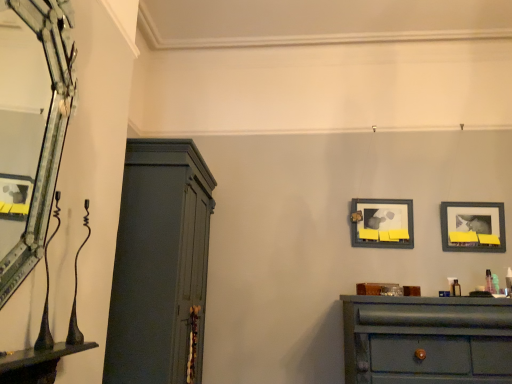
Image resolution: width=512 pixels, height=384 pixels. I want to click on matte green dresser at lower right, so click(x=426, y=340).

Measure the distance between matte green dresser at lower right and camera.

matte green dresser at lower right is 2.17 meters away from camera.

Find the location of a particular element. Image resolution: width=512 pixels, height=384 pixels. wooden framed picture at center, the second picture frame positioned from the right is located at coordinates (382, 223).

The image size is (512, 384). Describe the element at coordinates (160, 265) in the screenshot. I see `matte gray cupboard at left` at that location.

Where is `matte gray cupboard at left`? This screenshot has width=512, height=384. matte gray cupboard at left is located at coordinates (160, 265).

Describe the element at coordinates (472, 226) in the screenshot. I see `matte black picture frame at upper right, which ranks as the first picture frame in right-to-left order` at that location.

In order to click on matte green dresser at lower right in this screenshot , I will do `click(426, 340)`.

Is metallic silver mirror at left facing towards matte gray cupboard at left?

No, metallic silver mirror at left is not oriented towards matte gray cupboard at left.

Considering the sizes of objects metallic silver mirror at left and matte gray cupboard at left in the image provided, who is smaller, metallic silver mirror at left or matte gray cupboard at left?

metallic silver mirror at left is smaller.

How distant is metallic silver mirror at left from matte gray cupboard at left?

A distance of 4.49 feet exists between metallic silver mirror at left and matte gray cupboard at left.

How different are the orientations of metallic silver mirror at left and matte gray cupboard at left in degrees?

The angle between the facing direction of metallic silver mirror at left and the facing direction of matte gray cupboard at left is 0.493 degrees.

Can you confirm if metallic silver mirror at left is taller than matte green dresser at lower right?

Correct, metallic silver mirror at left is much taller as matte green dresser at lower right.

Which object is more forward, metallic silver mirror at left or matte green dresser at lower right?

metallic silver mirror at left is more forward.

Based on the photo, are metallic silver mirror at left and matte green dresser at lower right far apart?

Indeed, metallic silver mirror at left is not near matte green dresser at lower right.

Is point (24, 169) behind point (464, 307)?

Yes, it is behind point (464, 307).

Consider the image. What's the angular difference between matte green dresser at lower right and metallic silver mirror at left's facing directions?

There is a 90.4-degree angle between the facing directions of matte green dresser at lower right and metallic silver mirror at left.

From a real-world perspective, is matte green dresser at lower right located higher than metallic silver mirror at left?

No, from a real-world perspective, matte green dresser at lower right is not over metallic silver mirror at left

From the image's perspective, which is below, matte green dresser at lower right or metallic silver mirror at left?

matte green dresser at lower right.

In terms of height, does matte green dresser at lower right look taller or shorter compared to metallic silver mirror at left?

matte green dresser at lower right is shorter than metallic silver mirror at left.

Is point (415, 307) in front of point (462, 245)?

Yes, it is.

Is matte green dresser at lower right turned away from matte black picture frame at upper right, which ranks as the first picture frame in right-to-left order?

No.

Find the location of a particular element. The width and height of the screenshot is (512, 384). the chest of drawers located in front of the matte black picture frame at upper right, the 2th picture frame viewed from the left is located at coordinates (426, 340).

What's the angular difference between matte green dresser at lower right and matte black picture frame at upper right, which ranks as the first picture frame in right-to-left order,'s facing directions?

0.6 degrees separate the facing orientations of matte green dresser at lower right and matte black picture frame at upper right, which ranks as the first picture frame in right-to-left order.

Find the location of a particular element. This screenshot has width=512, height=384. chest of drawers on the left of matte black picture frame at upper right, which ranks as the first picture frame in right-to-left order is located at coordinates (426, 340).

Does matte black picture frame at upper right, which ranks as the first picture frame in right-to-left order, have a greater height compared to matte green dresser at lower right?

No, matte black picture frame at upper right, which ranks as the first picture frame in right-to-left order, is not taller than matte green dresser at lower right.

Considering the relative positions of matte black picture frame at upper right, the 2th picture frame viewed from the left, and matte green dresser at lower right in the image provided, is matte black picture frame at upper right, the 2th picture frame viewed from the left, to the right of matte green dresser at lower right from the viewer's perspective?

Indeed, matte black picture frame at upper right, the 2th picture frame viewed from the left, is positioned on the right side of matte green dresser at lower right.

Looking at this image, from a real-world perspective, which object stands above the other?

From a 3D spatial view, matte black picture frame at upper right, which ranks as the first picture frame in right-to-left order, is above.

In the scene shown: Can you confirm if matte gray cupboard at left is taller than metallic silver mirror at left?

Yes, matte gray cupboard at left is taller than metallic silver mirror at left.

Is matte gray cupboard at left thinner than metallic silver mirror at left?

No.

Is point (125, 239) positioned before point (51, 42)?

No, (125, 239) is behind (51, 42).

Are matte gray cupboard at left and metallic silver mirror at left making contact?

matte gray cupboard at left and metallic silver mirror at left are clearly separated.

Does matte black picture frame at upper right, which ranks as the first picture frame in right-to-left order, have a larger size compared to matte gray cupboard at left?

Incorrect, matte black picture frame at upper right, which ranks as the first picture frame in right-to-left order, is not larger than matte gray cupboard at left.

Does matte black picture frame at upper right, which ranks as the first picture frame in right-to-left order, have a greater height compared to matte gray cupboard at left?

No.

Is matte black picture frame at upper right, which ranks as the first picture frame in right-to-left order, looking in the opposite direction of matte gray cupboard at left?

No, matte black picture frame at upper right, which ranks as the first picture frame in right-to-left order,'s orientation is not away from matte gray cupboard at left.

What are the coordinates of `mirror above the matte gray cupboard at left (from the image's perspective)` in the screenshot? It's located at (31, 127).

Identify the location of mirror to the left of matte green dresser at lower right. The height and width of the screenshot is (384, 512). (31, 127).

Which object lies further to the anchor point metallic silver mirror at left, matte green dresser at lower right or wooden framed picture at center, which ranks as the first picture frame in left-to-right order?

matte green dresser at lower right is further to metallic silver mirror at left.

Estimate the real-world distances between objects in this image. Which object is closer to matte black picture frame at upper right, which ranks as the first picture frame in right-to-left order, wooden framed picture at center, which ranks as the first picture frame in left-to-right order, or matte gray cupboard at left?

The object closer to matte black picture frame at upper right, which ranks as the first picture frame in right-to-left order, is wooden framed picture at center, which ranks as the first picture frame in left-to-right order.

When comparing their distances from matte black picture frame at upper right, which ranks as the first picture frame in right-to-left order, does metallic silver mirror at left or matte green dresser at lower right seem closer?

matte green dresser at lower right is positioned closer to the anchor matte black picture frame at upper right, which ranks as the first picture frame in right-to-left order.

From the image, which object appears to be farther from matte gray cupboard at left, metallic silver mirror at left or matte black picture frame at upper right, which ranks as the first picture frame in right-to-left order?

Based on the image, matte black picture frame at upper right, which ranks as the first picture frame in right-to-left order, appears to be further to matte gray cupboard at left.

Based on their spatial positions, is wooden framed picture at center, which ranks as the first picture frame in left-to-right order, or matte gray cupboard at left further from metallic silver mirror at left?

wooden framed picture at center, which ranks as the first picture frame in left-to-right order, is further to metallic silver mirror at left.

Looking at the image, which one is located closer to wooden framed picture at center, which ranks as the first picture frame in left-to-right order, matte green dresser at lower right or matte black picture frame at upper right, the 2th picture frame viewed from the left?

Among the two, matte black picture frame at upper right, the 2th picture frame viewed from the left, is located nearer to wooden framed picture at center, which ranks as the first picture frame in left-to-right order.

Considering their positions, is wooden framed picture at center, the second picture frame positioned from the right, positioned further to matte black picture frame at upper right, the 2th picture frame viewed from the left, than matte green dresser at lower right?

matte green dresser at lower right lies further to matte black picture frame at upper right, the 2th picture frame viewed from the left, than the other object.

From the image, which object appears to be nearer to wooden framed picture at center, which ranks as the first picture frame in left-to-right order, matte green dresser at lower right or metallic silver mirror at left?

matte green dresser at lower right lies closer to wooden framed picture at center, which ranks as the first picture frame in left-to-right order, than the other object.

This screenshot has width=512, height=384. Identify the location of picture frame between matte gray cupboard at left and matte black picture frame at upper right, which ranks as the first picture frame in right-to-left order, from left to right. (382, 223).

Where is `picture frame between metallic silver mirror at left and wooden framed picture at center, which ranks as the first picture frame in left-to-right order, along the z-axis`? This screenshot has width=512, height=384. picture frame between metallic silver mirror at left and wooden framed picture at center, which ranks as the first picture frame in left-to-right order, along the z-axis is located at coordinates (472, 226).

You are a GUI agent. You are given a task and a screenshot of the screen. Output one action in this format:
    pyautogui.click(x=<x>, y=<y>)
    Task: Click on the picture frame between matte green dresser at lower right and wooden framed picture at center, which ranks as the first picture frame in left-to-right order, in the front-back direction
    
    Given the screenshot: What is the action you would take?
    pyautogui.click(x=472, y=226)

The height and width of the screenshot is (384, 512). What are the coordinates of `cupboard between metallic silver mirror at left and wooden framed picture at center, which ranks as the first picture frame in left-to-right order, in the front-back direction` in the screenshot? It's located at (160, 265).